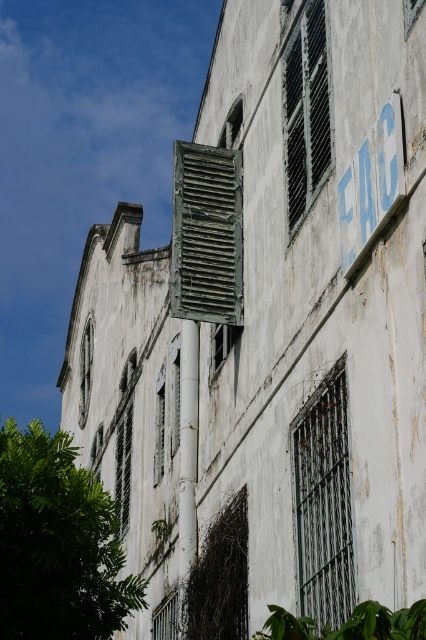
Consider the image. Is rusty metal shutter at center above blue painted sign at upper right?

No, rusty metal shutter at center is not above blue painted sign at upper right.

Is rusty metal shutter at center to the right of blue painted sign at upper right from the viewer's perspective?

Incorrect, rusty metal shutter at center is not on the right side of blue painted sign at upper right.

Find the location of a particular element. The height and width of the screenshot is (640, 426). rusty metal shutter at center is located at coordinates (324, 502).

Looking at this image, is green leafy tree at lower left shorter than blue painted sign at upper right?

No.

Does green leafy tree at lower left have a greater width compared to blue painted sign at upper right?

Yes, green leafy tree at lower left is wider than blue painted sign at upper right.

Between point (106, 632) and point (354, 218), which one is positioned behind?

The point (106, 632) is behind.

In order to click on green leafy tree at lower left in this screenshot , I will do `click(57, 544)`.

Which is more to the right, rusty metal shutter at center or weathered wood shutter at upper center?

rusty metal shutter at center is more to the right.

Does rusty metal shutter at center have a greater height compared to weathered wood shutter at upper center?

No.

Identify the location of rusty metal shutter at center. (324, 502).